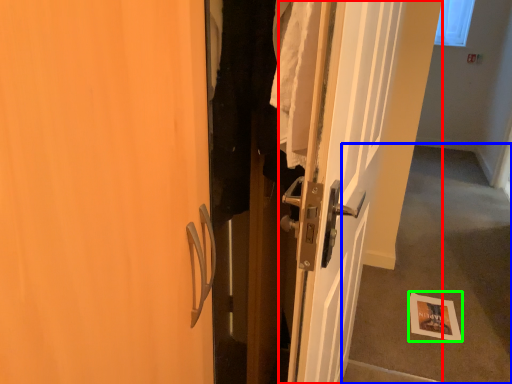
Question: Estimate the real-world distances between objects in this image. Which object is closer to door (highlighted by a red box), corridor (highlighted by a blue box) or postcard (highlighted by a green box)?

Choices:
 (A) corridor
 (B) postcard

Answer: (B)